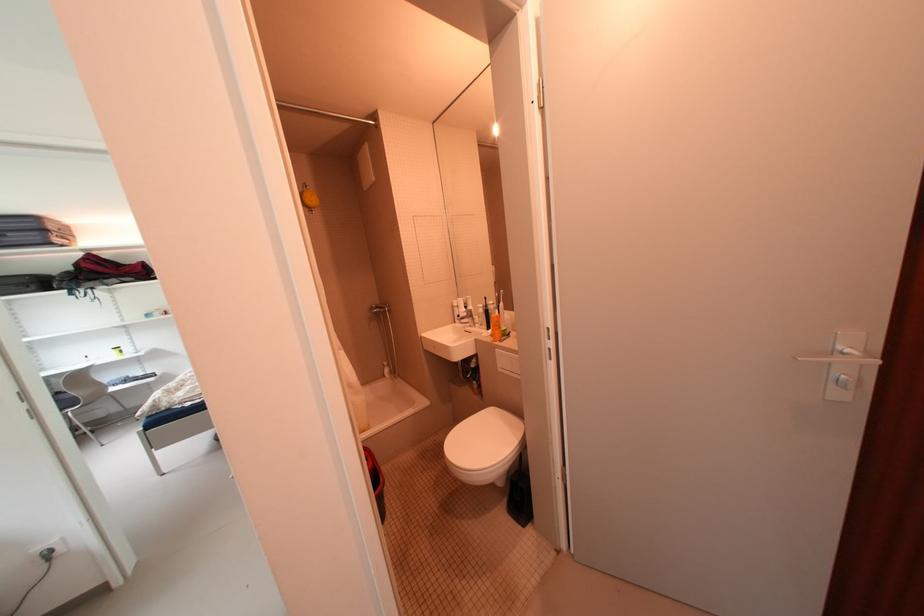
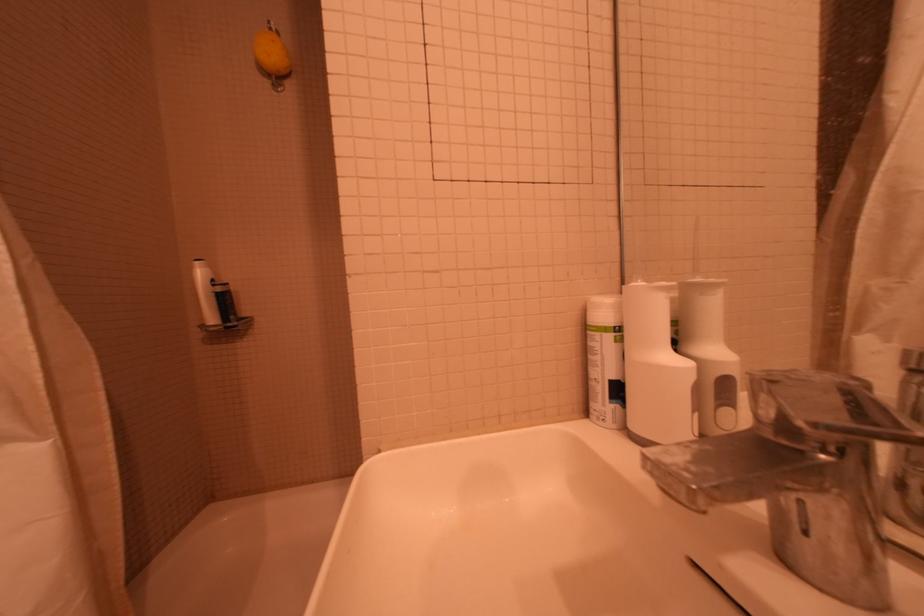
Locate, in the second image, the point that corresponds to point (460, 308) in the first image.

(593, 330)